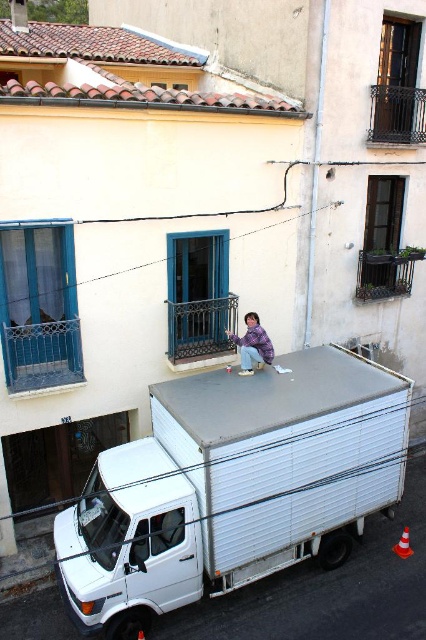
Question: Considering the relative positions of white matte truck at center and white matte van at lower left in the image provided, where is white matte truck at center located with respect to white matte van at lower left?

Choices:
 (A) right
 (B) left

Answer: (A)

Question: Is white matte van at lower left closer to camera compared to purple fabric at center?

Choices:
 (A) no
 (B) yes

Answer: (B)

Question: Is white matte van at lower left to the left of purple fabric at center from the viewer's perspective?

Choices:
 (A) yes
 (B) no

Answer: (A)

Question: Which is nearer to the white matte van at lower left?

Choices:
 (A) white matte truck at center
 (B) purple fabric at center

Answer: (A)

Question: Among these points, which one is nearest to the camera?

Choices:
 (A) (88, 508)
 (B) (244, 320)
 (C) (180, 419)

Answer: (C)

Question: Among these points, which one is nearest to the camera?

Choices:
 (A) pos(94,556)
 (B) pos(195,579)

Answer: (A)